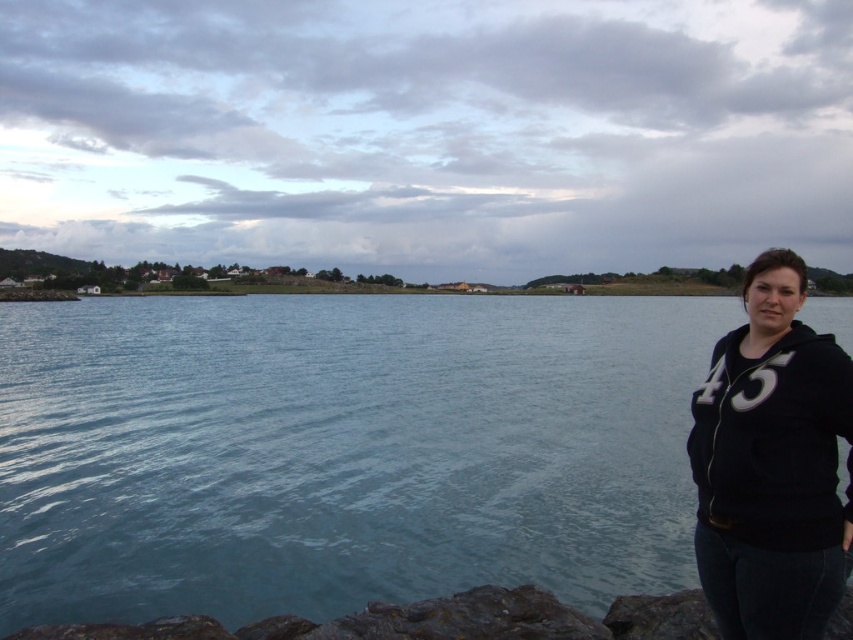
Between point (511, 477) and point (125, 636), which one is positioned behind?

The point (511, 477) is more distant.

Who is positioned more to the left, blue water at center or rusty rock at lower left?

Positioned to the left is blue water at center.

Which is behind, point (189, 387) or point (119, 625)?

The point (189, 387) is more distant.

You are a GUI agent. You are given a task and a screenshot of the screen. Output one action in this format:
    pyautogui.click(x=<x>, y=<y>)
    Task: Click on the blue water at center
    
    Given the screenshot: What is the action you would take?
    pyautogui.click(x=341, y=451)

Which of these two, blue water at center or black fleece at right, stands taller?

blue water at center is taller.

Is point (718, 305) less distant than point (822, 596)?

That is False.

What do you see at coordinates (341, 451) in the screenshot?
I see `blue water at center` at bounding box center [341, 451].

Where is `blue water at center`? Image resolution: width=853 pixels, height=640 pixels. blue water at center is located at coordinates (341, 451).

Can you confirm if black fleece at right is positioned to the left of rusty rock at lower left?

Incorrect, black fleece at right is not on the left side of rusty rock at lower left.

Does point (805, 416) lie in front of point (521, 628)?

Yes, point (805, 416) is in front of point (521, 628).

Who is more forward, (730, 516) or (372, 616)?

Point (730, 516) is more forward.

Locate an element on the screen. This screenshot has width=853, height=640. black fleece at right is located at coordinates (772, 465).